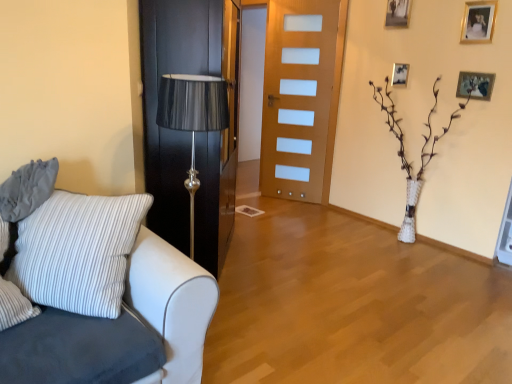
The width and height of the screenshot is (512, 384). Describe the element at coordinates (27, 189) in the screenshot. I see `gray fabric pillow at left` at that location.

At what (x,y) coordinates should I click in order to perform the action: click on gray fabric pillow at left. Please return your answer as a coordinate pair (x, y). Looking at the image, I should click on [x=27, y=189].

Identify the location of wooden picture frame at upper right, marked as the 1th picture frame in a right-to-left arrangement. (475, 85).

The image size is (512, 384). What do you see at coordinates (405, 157) in the screenshot? I see `white textured vase at center right` at bounding box center [405, 157].

Measure the distance between point (495,3) and camera.

Point (495,3) and camera are 3.02 meters apart from each other.

Locate an element on the screen. The width and height of the screenshot is (512, 384). gray fabric pillow at left is located at coordinates (27, 189).

Is black wood door at center, the 2th door when ordered from back to front, far from wooden picture frame at upper right, the 1th picture frame from the top?

That's right, there is a large distance between black wood door at center, the 2th door when ordered from back to front, and wooden picture frame at upper right, the 1th picture frame from the top.

Is black wood door at center, the 1th door when ordered from left to right, smaller than wooden picture frame at upper right, which appears as the fourth picture frame when viewed from the right?

Actually, black wood door at center, the 1th door when ordered from left to right, might be larger than wooden picture frame at upper right, which appears as the fourth picture frame when viewed from the right.

From the image's perspective, which door is the 1st one above the gray fabric pillow at left? Please provide its 2D coordinates.

[(189, 132)]

How far apart are black wood door at center, which is the first door from front to back, and gray fabric pillow at left?

black wood door at center, which is the first door from front to back, and gray fabric pillow at left are 33.10 inches apart.

Is black wood door at center, which is counted as the 2th door, starting from the right, taller or shorter than gray fabric pillow at left?

black wood door at center, which is counted as the 2th door, starting from the right, is taller than gray fabric pillow at left.

From the image's perspective, is white fabric couch at left below wooden picture frame at upper right, which is counted as the 2th picture frame, starting from the bottom?

Yes, from the image's perspective, white fabric couch at left is beneath wooden picture frame at upper right, which is counted as the 2th picture frame, starting from the bottom.

Can you confirm if white fabric couch at left is shorter than wooden picture frame at upper right, which is counted as the third picture frame, starting from the right?

In fact, white fabric couch at left may be taller than wooden picture frame at upper right, which is counted as the third picture frame, starting from the right.

Consider the image. Does white fabric couch at left have a lesser width compared to wooden picture frame at upper right, positioned as the second picture frame in left-to-right order?

No.

How many degrees apart are the facing directions of white fabric couch at left and wooden picture frame at upper right, positioned as the second picture frame in left-to-right order?

white fabric couch at left and wooden picture frame at upper right, positioned as the second picture frame in left-to-right order, are facing 89 degrees away from each other.

Which is nearer, (308, 167) or (47, 290)?

Point (47, 290)

Is wooden door at center, which is counted as the second door, starting from the left, wider or thinner than white fabric couch at left?

Clearly, wooden door at center, which is counted as the second door, starting from the left, has less width compared to white fabric couch at left.

Is wooden door at center, marked as the 1th door in a right-to-left arrangement, oriented towards white fabric couch at left?

No, wooden door at center, marked as the 1th door in a right-to-left arrangement, is not oriented towards white fabric couch at left.

Is wooden door at center, which is counted as the second door, starting from the left, at the left side of white textured vase at center right?

Correct, you'll find wooden door at center, which is counted as the second door, starting from the left, to the left of white textured vase at center right.

Would you consider wooden door at center, marked as the 1th door in a right-to-left arrangement, to be distant from white textured vase at center right?

That's not correct — wooden door at center, marked as the 1th door in a right-to-left arrangement, is a little close to white textured vase at center right.

Is wooden door at center, the first door in the back-to-front sequence, wider or thinner than white textured vase at center right?

Clearly, wooden door at center, the first door in the back-to-front sequence, has less width compared to white textured vase at center right.

Which is in front, wooden door at center, which is counted as the second door, starting from the left, or white textured vase at center right?

white textured vase at center right is closer to the camera.

Are gold metallic picture frame at upper right, acting as the third picture frame starting from the left, and wooden picture frame at upper right, the 1th picture frame from the top, making contact?

No.

Is gold metallic picture frame at upper right, the second picture frame from the right, wider than wooden picture frame at upper right, the 1th picture frame from the top?

In fact, gold metallic picture frame at upper right, the second picture frame from the right, might be narrower than wooden picture frame at upper right, the 1th picture frame from the top.

Is gold metallic picture frame at upper right, the second picture frame from the right, aimed at wooden picture frame at upper right, the 1th picture frame from the top?

No, gold metallic picture frame at upper right, the second picture frame from the right, is not oriented towards wooden picture frame at upper right, the 1th picture frame from the top.

The image size is (512, 384). I want to click on the 2nd picture frame counting from the left of the gold metallic picture frame at upper right, the second picture frame from the right, so click(x=397, y=14).

Is wooden picture frame at upper right, the 4th picture frame positioned from the top, not inside wooden picture frame at upper right, which appears as the fourth picture frame when viewed from the right?

That's correct, wooden picture frame at upper right, the 4th picture frame positioned from the top, is outside of wooden picture frame at upper right, which appears as the fourth picture frame when viewed from the right.

Considering the sizes of objects wooden picture frame at upper right, marked as the 1th picture frame in a right-to-left arrangement, and wooden picture frame at upper right, arranged as the 1th picture frame when viewed from the left, in the image provided, who is smaller, wooden picture frame at upper right, marked as the 1th picture frame in a right-to-left arrangement, or wooden picture frame at upper right, arranged as the 1th picture frame when viewed from the left,?

A: wooden picture frame at upper right, marked as the 1th picture frame in a right-to-left arrangement, is smaller.

Can you tell me how much wooden picture frame at upper right, marked as the 1th picture frame in a right-to-left arrangement, and wooden picture frame at upper right, positioned as the 4th picture frame in bottom-to-top order, differ in facing direction?

wooden picture frame at upper right, marked as the 1th picture frame in a right-to-left arrangement, and wooden picture frame at upper right, positioned as the 4th picture frame in bottom-to-top order, are facing 0.109 degrees away from each other.

Considering the sizes of wooden picture frame at upper right, the 4th picture frame positioned from the left, and wooden picture frame at upper right, positioned as the 4th picture frame in bottom-to-top order, in the image, is wooden picture frame at upper right, the 4th picture frame positioned from the left, wider or thinner than wooden picture frame at upper right, positioned as the 4th picture frame in bottom-to-top order,?

wooden picture frame at upper right, the 4th picture frame positioned from the left, is thinner than wooden picture frame at upper right, positioned as the 4th picture frame in bottom-to-top order.

What are the coordinates of `the 1st picture frame counting from the right of the black wood door at center, which is counted as the 2th door, starting from the right` in the screenshot? It's located at (397, 14).

The height and width of the screenshot is (384, 512). In order to click on pillow located below the black wood door at center, which is the first door from front to back (from the image's perspective) in this screenshot , I will do `click(27, 189)`.

Looking at the image, which one is located closer to black wood door at center, which is the first door from front to back, wooden picture frame at upper right, the 4th picture frame positioned from the left, or white fabric couch at left?

white fabric couch at left lies closer to black wood door at center, which is the first door from front to back, than the other object.

Based on their spatial positions, is wooden picture frame at upper right, arranged as the 1th picture frame when viewed from the left, or gray fabric pillow at left closer to white textured vase at center right?

wooden picture frame at upper right, arranged as the 1th picture frame when viewed from the left, lies closer to white textured vase at center right than the other object.

Which object lies nearer to the anchor point wooden picture frame at upper right, which appears as the first picture frame when ordered from the bottom, black wood door at center, the 2th door when ordered from back to front, or white fabric couch at left?

The object closer to wooden picture frame at upper right, which appears as the first picture frame when ordered from the bottom, is black wood door at center, the 2th door when ordered from back to front.

From the image, which object appears to be nearer to wooden door at center, the first door in the back-to-front sequence, white fabric couch at left or gray fabric pillow at left?

Based on the image, white fabric couch at left appears to be nearer to wooden door at center, the first door in the back-to-front sequence.

Considering their positions, is gray fabric pillow at left positioned further to wooden picture frame at upper right, the 3th picture frame positioned from the top, than wooden door at center, the first door in the back-to-front sequence?

Among the two, gray fabric pillow at left is located further to wooden picture frame at upper right, the 3th picture frame positioned from the top.

When comparing their distances from wooden picture frame at upper right, the 1th picture frame from the top, does wooden picture frame at upper right, which is counted as the 2th picture frame, starting from the bottom, or wooden picture frame at upper right, the 4th picture frame positioned from the left, seem closer?

wooden picture frame at upper right, which is counted as the 2th picture frame, starting from the bottom, lies closer to wooden picture frame at upper right, the 1th picture frame from the top, than the other object.

Looking at the image, which one is located closer to wooden picture frame at upper right, the 1th picture frame from the top, white fabric couch at left or wooden picture frame at upper right, the 4th picture frame positioned from the top?

The object closer to wooden picture frame at upper right, the 1th picture frame from the top, is wooden picture frame at upper right, the 4th picture frame positioned from the top.

Based on their spatial positions, is gray fabric pillow at left or white textured vase at center right closer to white fabric couch at left?

The object closer to white fabric couch at left is gray fabric pillow at left.

Identify the location of door between white fabric couch at left and wooden picture frame at upper right, arranged as the 1th picture frame when viewed from the left, from front to back. This screenshot has width=512, height=384. pos(189,132).

This screenshot has width=512, height=384. Identify the location of door between gray fabric pillow at left and wooden door at center, marked as the 1th door in a right-to-left arrangement, along the z-axis. coord(189,132).

Locate an element on the screen. pillow located between white fabric couch at left and wooden picture frame at upper right, which is counted as the 2th picture frame, starting from the bottom, in the depth direction is located at coordinates (27, 189).

The image size is (512, 384). I want to click on door located between white fabric couch at left and wooden picture frame at upper right, the 3th picture frame positioned from the top, in the depth direction, so 189,132.